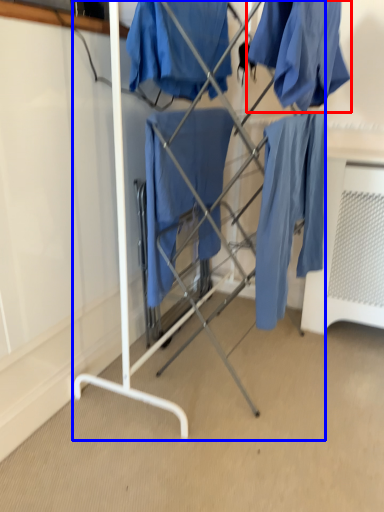
Question: Which point is closer to the camera, clothing (highlighted by a red box) or furniture (highlighted by a blue box)?

Choices:
 (A) clothing
 (B) furniture

Answer: (A)